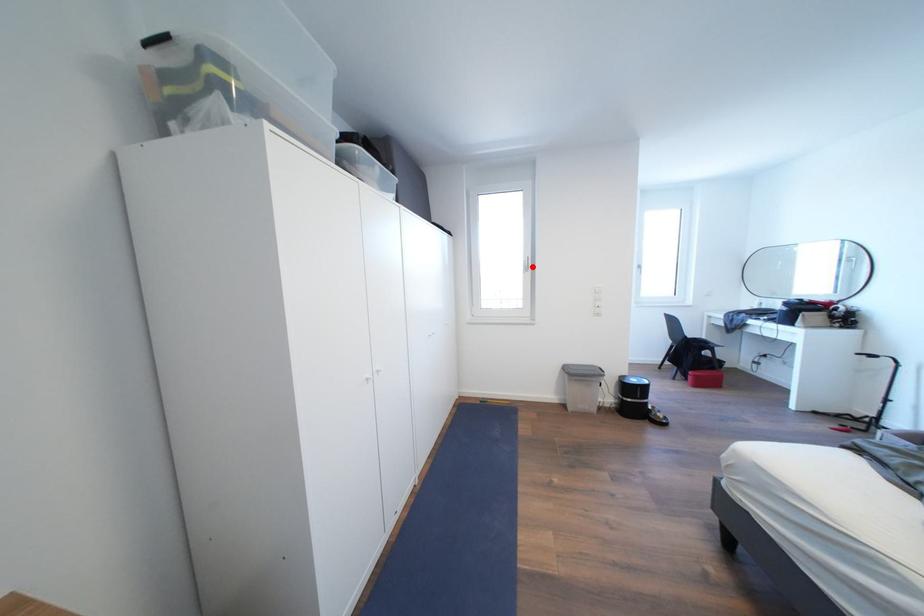
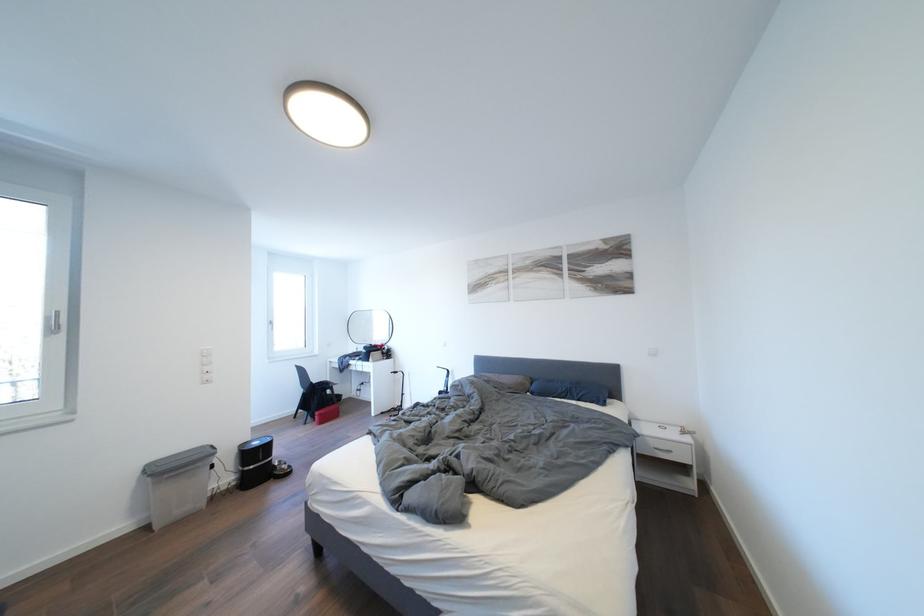
In the second image, find the point that corresponds to the highlighted location in the first image.

(56, 323)